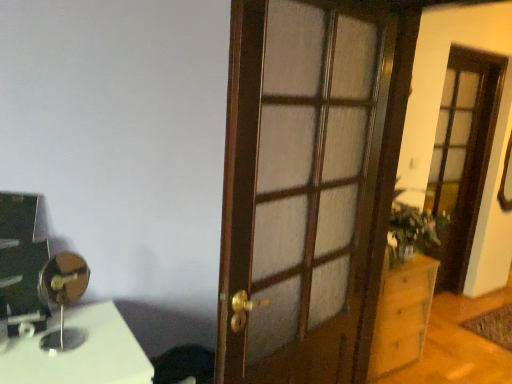
Question: Is wooden cabinet at right to the left or to the right of green leafy plant at right in the image?

Choices:
 (A) right
 (B) left

Answer: (B)

Question: Considering the positions of wooden cabinet at right and green leafy plant at right in the image, is wooden cabinet at right wider or thinner than green leafy plant at right?

Choices:
 (A) wide
 (B) thin

Answer: (A)

Question: Which object is positioned farthest from the wooden cabinet at right?

Choices:
 (A) black leather swivel chair at lower left
 (B) metallic gold table lamp at left
 (C) wooden screen door at right
 (D) green leafy plant at right
 (E) wooden door at center

Answer: (B)

Question: Considering the real-world distances, which object is farthest from the wooden cabinet at right?

Choices:
 (A) green leafy plant at right
 (B) metallic gold table lamp at left
 (C) wooden door at center
 (D) black leather swivel chair at lower left
 (E) wooden screen door at right

Answer: (B)